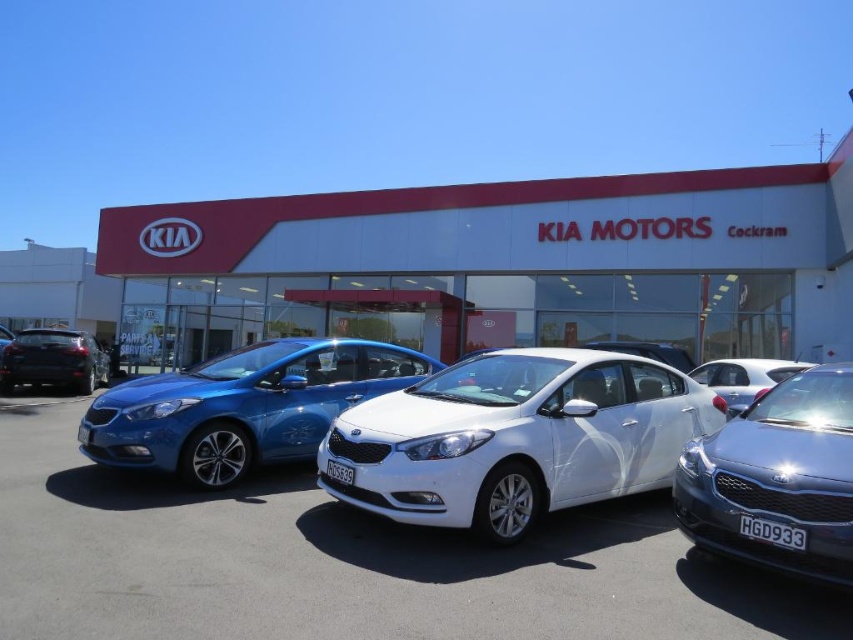
Is white glossy sedan at center positioned at the back of matte black sedan at left?

That is False.

Is point (383, 397) closer to camera compared to point (13, 358)?

Yes, it is in front of point (13, 358).

You are a GUI agent. You are given a task and a screenshot of the screen. Output one action in this format:
    pyautogui.click(x=<x>, y=<y>)
    Task: Click on the white glossy sedan at center
    This screenshot has width=853, height=640.
    Given the screenshot: What is the action you would take?
    tap(515, 438)

Locate an element on the screen. white glossy car at center is located at coordinates (502, 264).

Where is `white glossy car at center`? This screenshot has width=853, height=640. white glossy car at center is located at coordinates (502, 264).

What do you see at coordinates (242, 406) in the screenshot?
I see `matte white sedan at center` at bounding box center [242, 406].

Can you confirm if matte white sedan at center is positioned to the left of satin silver car at center?

Yes, matte white sedan at center is to the left of satin silver car at center.

Is point (251, 444) farther from viewer compared to point (764, 360)?

No, it is not.

The image size is (853, 640). In order to click on matte white sedan at center in this screenshot , I will do `click(242, 406)`.